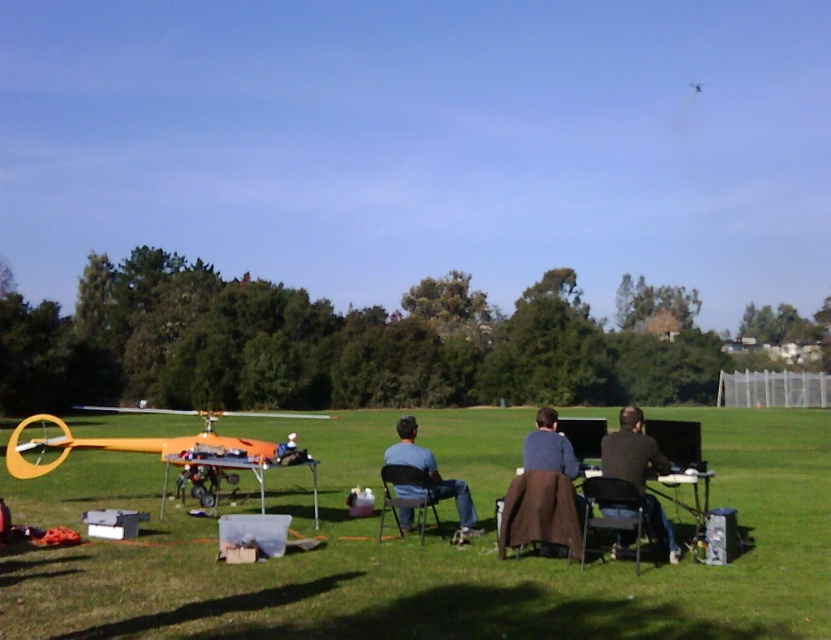
Which is above, brown fabric chair at center or metallic silver chair at center?

brown fabric chair at center is above.

Find the location of a particular element. Image resolution: width=831 pixels, height=640 pixels. brown fabric chair at center is located at coordinates (539, 513).

The width and height of the screenshot is (831, 640). I want to click on brown fabric chair at center, so pyautogui.click(x=539, y=513).

Locate an element on the screen. The height and width of the screenshot is (640, 831). green grass at center is located at coordinates (421, 554).

You are a GUI agent. You are given a task and a screenshot of the screen. Output one action in this format:
    pyautogui.click(x=<x>, y=<y>)
    Task: Click on the green grass at center
    This screenshot has height=640, width=831.
    Given the screenshot: What is the action you would take?
    pyautogui.click(x=421, y=554)

You are a GUI agent. You are given a task and a screenshot of the screen. Output one action in this format:
    pyautogui.click(x=<x>, y=<y>)
    Task: Click on the black matte shirt at center
    Image resolution: width=831 pixels, height=640 pixels.
    Given the screenshot: What is the action you would take?
    pyautogui.click(x=638, y=468)